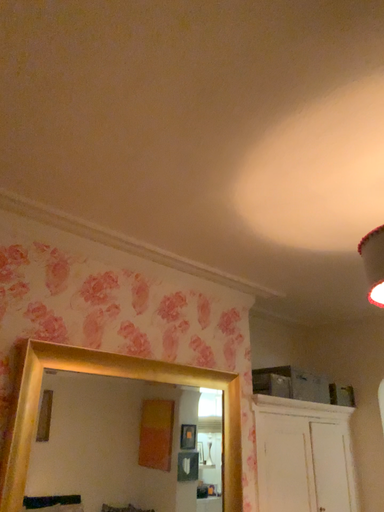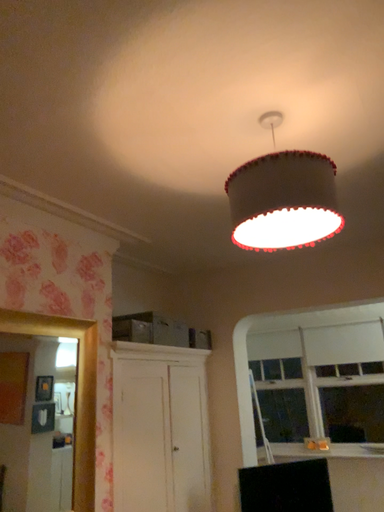
Question: Which way did the camera rotate in the video?

Choices:
 (A) rotated left
 (B) rotated right

Answer: (B)